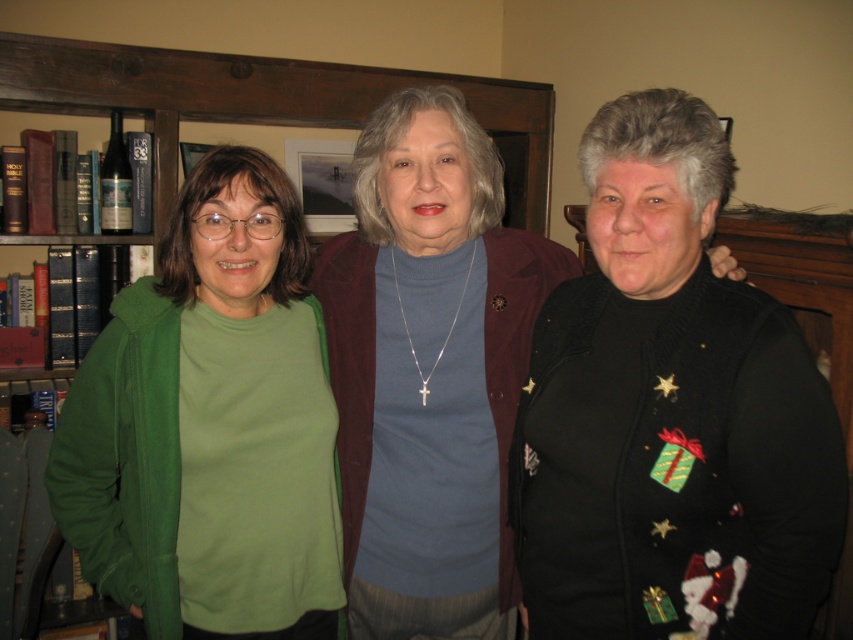
Is green fleece jacket at left taller than wooden bookshelf at upper left?

Yes, green fleece jacket at left is taller than wooden bookshelf at upper left.

Between green fleece jacket at left and wooden bookshelf at upper left, which one is positioned lower?

Positioned lower is green fleece jacket at left.

Which is in front, point (154, 525) or point (107, 81)?

Point (154, 525)

The image size is (853, 640). Identify the location of green fleece jacket at left. (212, 426).

Between black fuzzy sweater at right and green fleece jacket at left, which one has more height?

green fleece jacket at left

Can you confirm if black fuzzy sweater at right is positioned above green fleece jacket at left?

Yes, black fuzzy sweater at right is above green fleece jacket at left.

Does point (704, 490) lie in front of point (126, 365)?

Yes, it is in front of point (126, 365).

Find the location of `black fuzzy sweater at right`. black fuzzy sweater at right is located at coordinates (670, 413).

Is black fuzzy sweater at right wider than wooden bookshelf at upper left?

No, black fuzzy sweater at right is not wider than wooden bookshelf at upper left.

Between black fuzzy sweater at right and wooden bookshelf at upper left, which one appears on the left side from the viewer's perspective?

wooden bookshelf at upper left

Identify the location of black fuzzy sweater at right. (670, 413).

This screenshot has height=640, width=853. Identify the location of black fuzzy sweater at right. tap(670, 413).